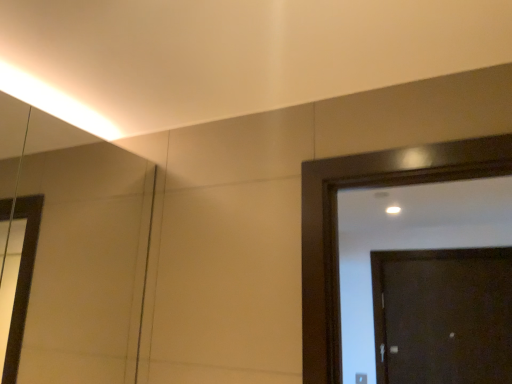
The image size is (512, 384). What do you see at coordinates (443, 316) in the screenshot?
I see `dark wood door at right` at bounding box center [443, 316].

In order to face dark wood door at right, should I rotate leftwards or rightwards?

You should rotate right by 21.001 degrees.

This screenshot has width=512, height=384. In order to click on dark wood door at right in this screenshot , I will do `click(443, 316)`.

In the scene shown: Measure the distance between dark wood door at right and camera.

A distance of 9.31 feet exists between dark wood door at right and camera.

This screenshot has width=512, height=384. Identify the location of dark wood door at right. (443, 316).